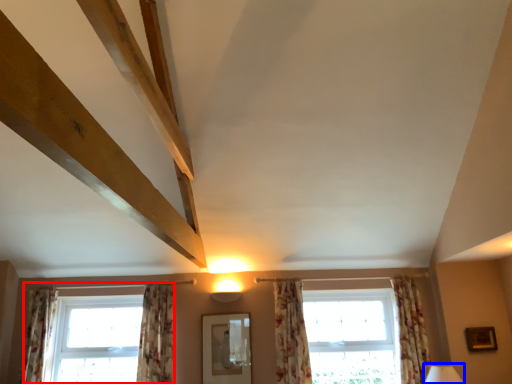
Question: Which point is closer to the camera, window (highlighted by a red box) or table lamp (highlighted by a blue box)?

Choices:
 (A) window
 (B) table lamp

Answer: (B)